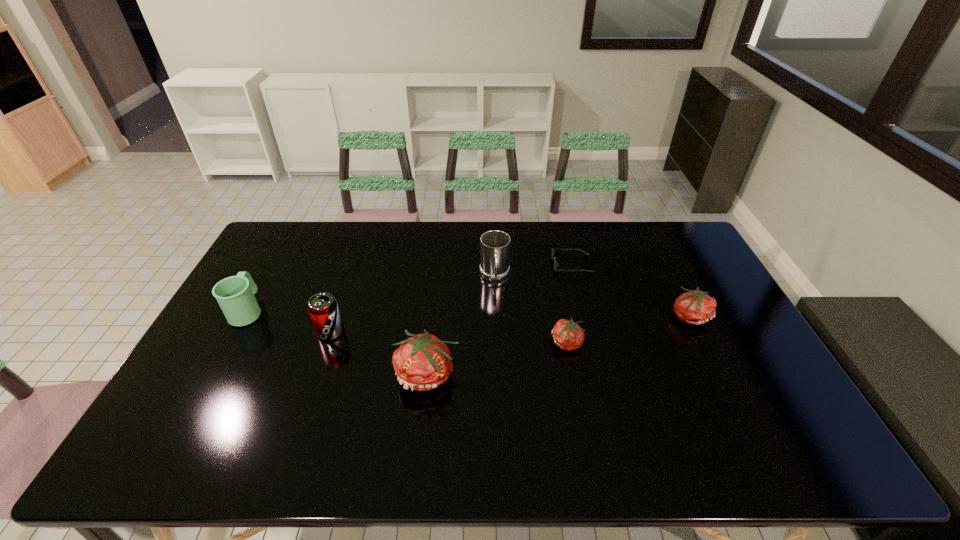
Where is `the leftmost tomato`? This screenshot has height=540, width=960. the leftmost tomato is located at coordinates (422, 362).

This screenshot has height=540, width=960. I want to click on the third object from left to right, so click(422, 362).

This screenshot has width=960, height=540. I want to click on the second tomato from right to left, so (x=568, y=335).

The image size is (960, 540). Find the location of `the sixth tallest object`. the sixth tallest object is located at coordinates (568, 335).

Find the location of a particular element. The image size is (960, 540). the rightmost object is located at coordinates (695, 307).

Identify the location of the rightmost tomato. Image resolution: width=960 pixels, height=540 pixels. (695, 307).

Identify the location of sunglasses. (556, 264).

Locate an element on the screen. This screenshot has width=960, height=540. the fourth object from right to left is located at coordinates (495, 245).

The height and width of the screenshot is (540, 960). Identify the location of the right mug. (495, 245).

Identify the location of soda can. (323, 309).